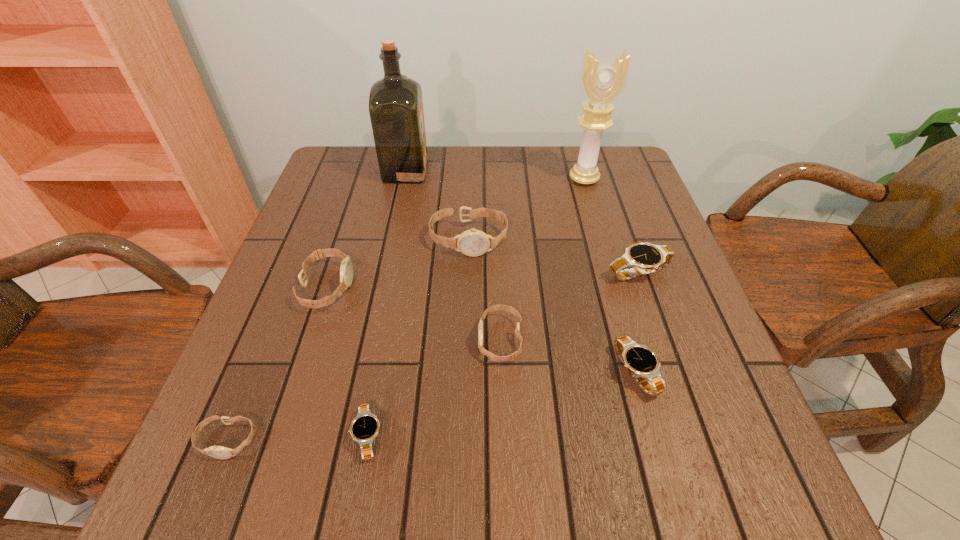
This screenshot has width=960, height=540. I want to click on free spot located 0.200m on the left of the second farthest black watch, so click(505, 373).

The height and width of the screenshot is (540, 960). I want to click on vacant space located on the right of the shortest object, so click(451, 436).

At what (x,y) coordinates should I click in order to perform the action: click on liquor that is at the far edge. Please return your answer as a coordinate pair (x, y). The image size is (960, 540). Looking at the image, I should click on (396, 112).

Find the location of a particular element. award located in the far edge section of the desktop is located at coordinates (602, 80).

Locate an element on the screen. This screenshot has width=960, height=540. award at the right edge is located at coordinates (602, 80).

At what (x,y) coordinates should I click in order to perform the action: click on object situated at the near left corner. Please return your answer as a coordinate pair (x, y). The image size is (960, 540). Looking at the image, I should click on (219, 452).

Identify the location of object at the far right corner. (602, 80).

Where is `blank area at the far edge`? blank area at the far edge is located at coordinates [404, 183].

Where is `free space at the left edge of the desktop`? The height and width of the screenshot is (540, 960). free space at the left edge of the desktop is located at coordinates (282, 368).

At what (x,y) coordinates should I click in order to perform the action: click on vacant space at the right edge of the desktop. Please return your answer as a coordinate pair (x, y). Looking at the image, I should click on (657, 285).